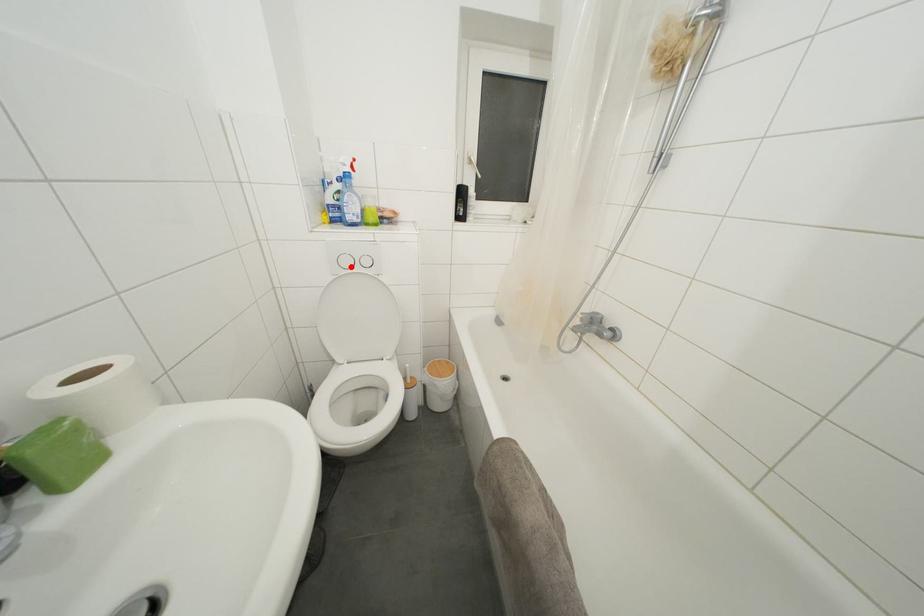
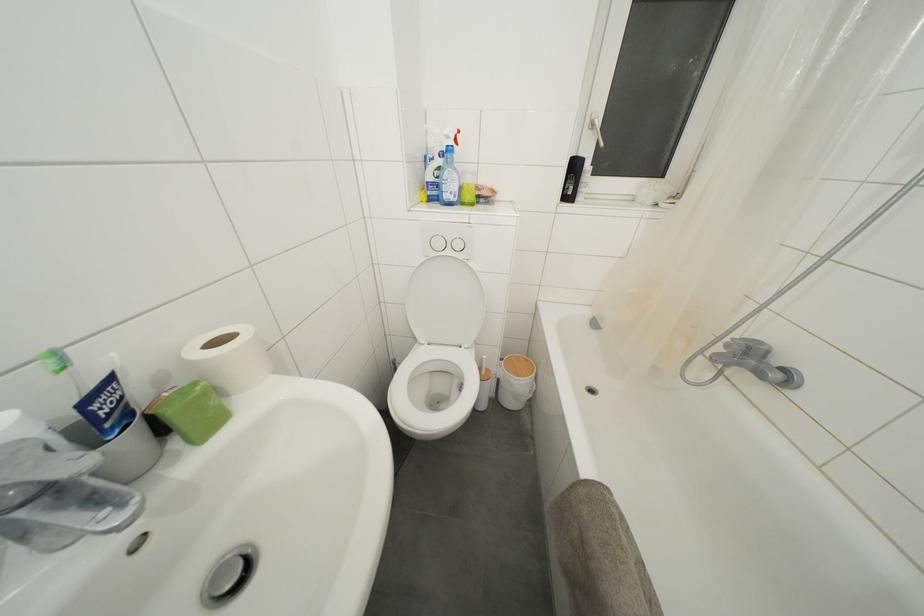
The point at the highlighted location is marked in the first image. Where is the corresponding point in the second image?

(443, 249)